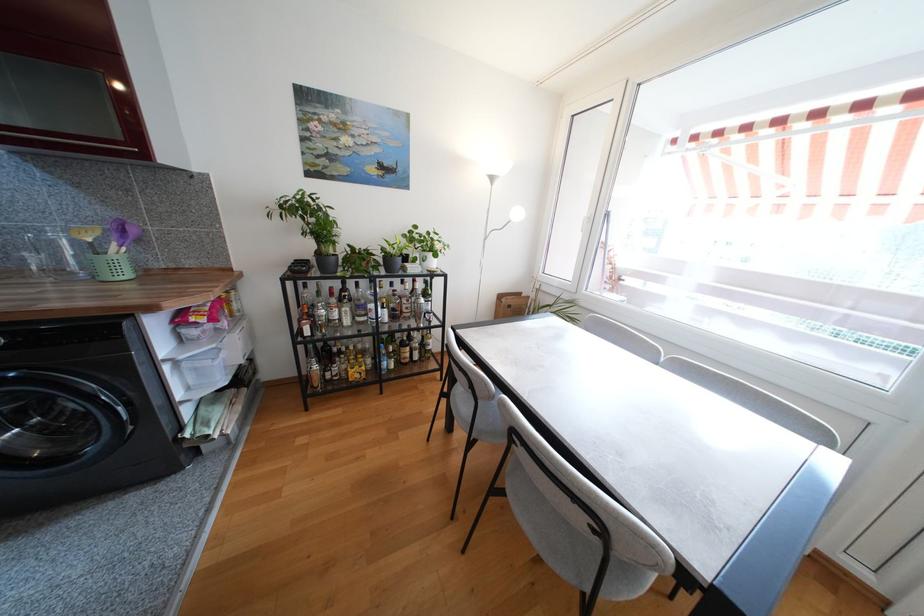
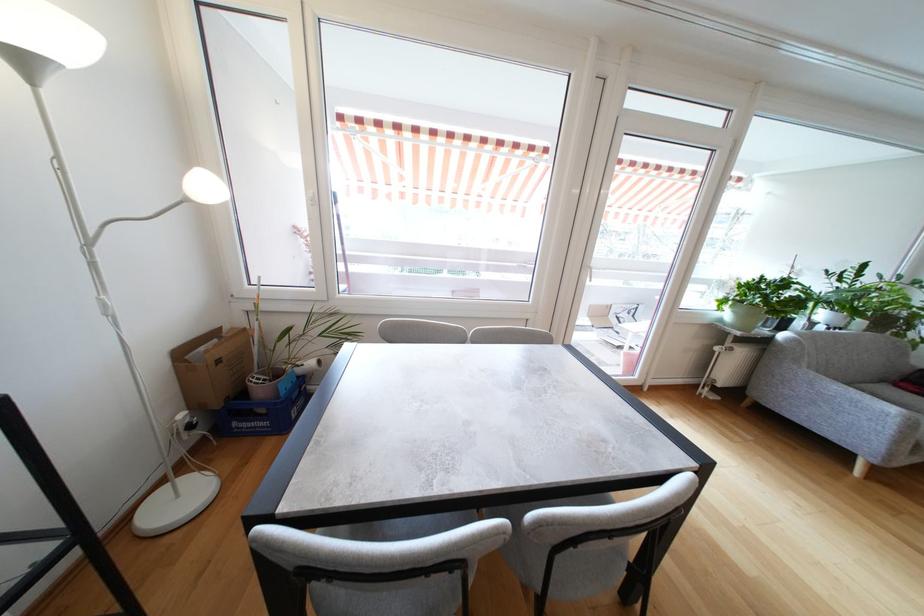
Find the pixel in the second image that matches (x=490, y=241) in the first image.

(93, 246)